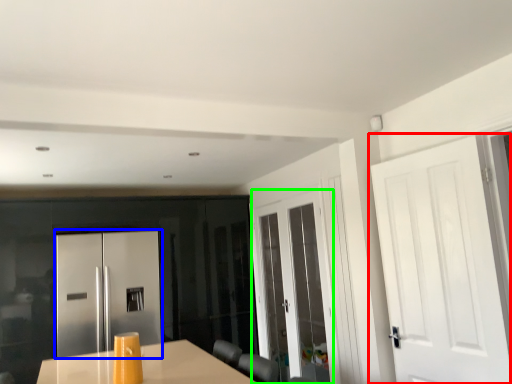
Question: Based on their relative distances, which object is nearer to door (highlighted by a red box)? Choose from door (highlighted by a blue box) and door (highlighted by a green box).

Choices:
 (A) door
 (B) door

Answer: (B)